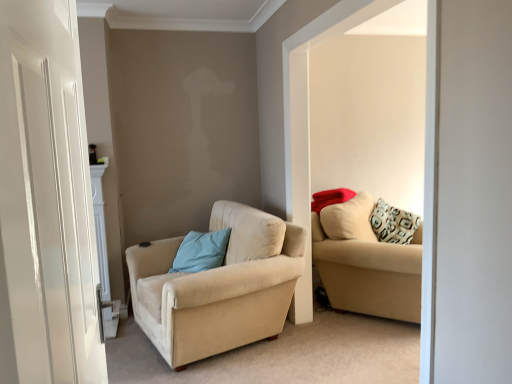
Question: Is beige fabric couch at right bigger than light blue fabric pillow at center-left?

Choices:
 (A) no
 (B) yes

Answer: (B)

Question: Can you confirm if beige fabric couch at right is positioned to the left of light blue fabric pillow at center-left?

Choices:
 (A) no
 (B) yes

Answer: (A)

Question: Is beige fabric couch at right located outside light blue fabric pillow at center-left?

Choices:
 (A) yes
 (B) no

Answer: (A)

Question: Does beige fabric couch at right have a greater width compared to light blue fabric pillow at center-left?

Choices:
 (A) yes
 (B) no

Answer: (B)

Question: From a real-world perspective, is beige fabric couch at right located higher than light blue fabric pillow at center-left?

Choices:
 (A) yes
 (B) no

Answer: (A)

Question: Considering the positions of beige fabric couch at right and white glossy door at left in the image, is beige fabric couch at right wider or thinner than white glossy door at left?

Choices:
 (A) thin
 (B) wide

Answer: (B)

Question: From the image's perspective, is beige fabric couch at right located above or below white glossy door at left?

Choices:
 (A) below
 (B) above

Answer: (B)

Question: From a real-world perspective, is beige fabric couch at right above or below white glossy door at left?

Choices:
 (A) above
 (B) below

Answer: (B)

Question: Is beige fabric couch at right inside the boundaries of white glossy door at left, or outside?

Choices:
 (A) inside
 (B) outside

Answer: (B)

Question: Is beige fabric armchair at left, which is counted as the 2th studio couch, starting from the right, bigger or smaller than beige fabric couch at right?

Choices:
 (A) big
 (B) small

Answer: (A)

Question: Which is correct: beige fabric armchair at left, acting as the 1th studio couch starting from the left, is inside beige fabric couch at right, or outside of it?

Choices:
 (A) inside
 (B) outside

Answer: (B)

Question: Considering the positions of point (172, 314) and point (324, 187), is point (172, 314) closer or farther from the camera than point (324, 187)?

Choices:
 (A) farther
 (B) closer

Answer: (B)

Question: In the image, is beige fabric armchair at left, which is counted as the 2th studio couch, starting from the right, on the left side or the right side of beige fabric couch at right?

Choices:
 (A) right
 (B) left

Answer: (B)

Question: In terms of size, does light blue fabric pillow at center-left appear bigger or smaller than white glossy door at left?

Choices:
 (A) small
 (B) big

Answer: (A)

Question: Considering the positions of point (227, 228) and point (20, 329), is point (227, 228) closer or farther from the camera than point (20, 329)?

Choices:
 (A) closer
 (B) farther

Answer: (B)